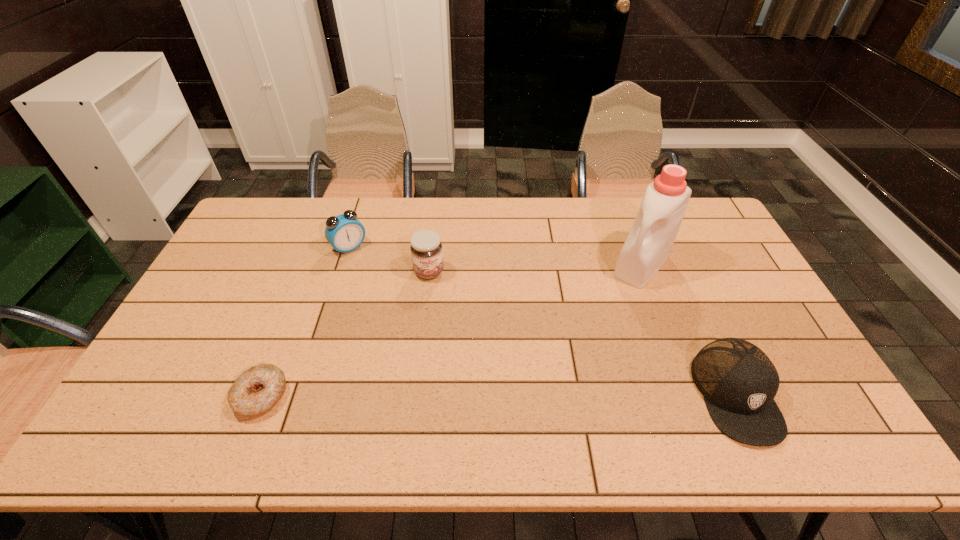
Where is `vacant space at the far edge of the desktop`? vacant space at the far edge of the desktop is located at coordinates (456, 232).

What are the coordinates of `free location at the near edge` in the screenshot? It's located at (222, 390).

Find the location of a particular element. This screenshot has width=960, height=540. vacant area at the left edge is located at coordinates (219, 282).

Locate an element on the screen. Image resolution: width=960 pixels, height=540 pixels. vacant region at the right edge of the desktop is located at coordinates (796, 368).

Find the location of a particular element. This screenshot has height=540, width=960. vacant area at the far left corner of the desktop is located at coordinates (272, 200).

In order to click on vacant space at the far right corner of the desktop in this screenshot , I will do `click(684, 221)`.

Identify the location of free space at the near right corner of the desktop. Image resolution: width=960 pixels, height=540 pixels. (792, 400).

Where is `free space between the doughnut and the cap`? The height and width of the screenshot is (540, 960). free space between the doughnut and the cap is located at coordinates (498, 395).

You are a GUI agent. You are given a task and a screenshot of the screen. Output one action in this format:
    pyautogui.click(x=<x>, y=<y>)
    Task: Click on the free space between the doughnut and the detergent
    Image resolution: width=960 pixels, height=540 pixels.
    Given the screenshot: What is the action you would take?
    pyautogui.click(x=451, y=330)

The height and width of the screenshot is (540, 960). I want to click on free spot between the cap and the alarm clock, so click(542, 321).